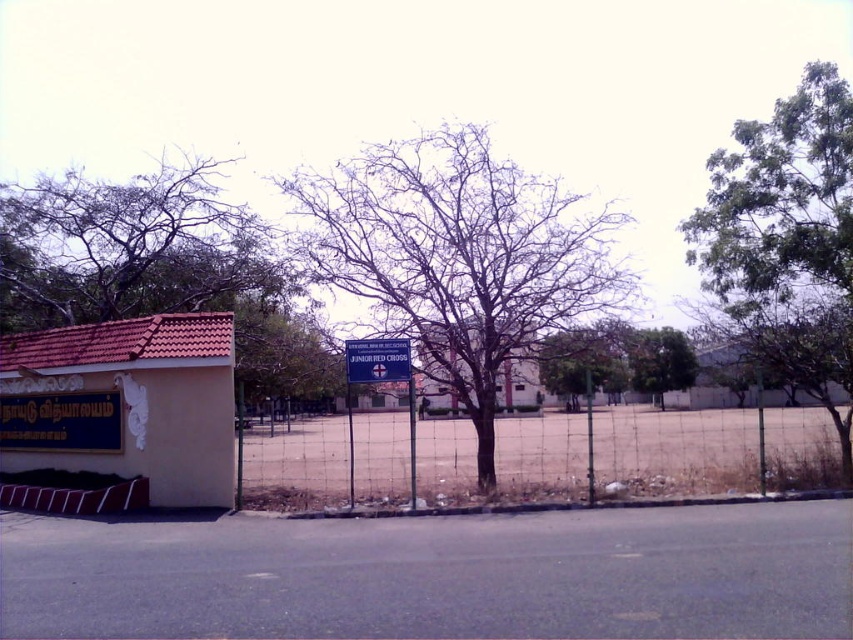
Question: Which of these objects is positioned closest to the wire mesh fence at center?

Choices:
 (A) green leafy tree at upper right
 (B) green leafy tree at right
 (C) brown textured tree at left
 (D) blue plastic sign at center

Answer: (D)

Question: Is bare branches at center to the left of blue plastic sign at center from the viewer's perspective?

Choices:
 (A) no
 (B) yes

Answer: (A)

Question: Estimate the real-world distances between objects in this image. Which object is farther from the brown textured tree at left?

Choices:
 (A) yellow matte sign at lower left
 (B) bare branches at center
 (C) wire mesh fence at center
 (D) green leafy tree at right

Answer: (D)

Question: Which of these objects is positioned closest to the bare branches at center?

Choices:
 (A) green leafy tree at right
 (B) brown textured tree at left

Answer: (A)

Question: Is green leafy tree at right positioned at the back of blue plastic sign at center?

Choices:
 (A) no
 (B) yes

Answer: (A)

Question: Is bare branches at center positioned in front of brown textured tree at left?

Choices:
 (A) yes
 (B) no

Answer: (A)